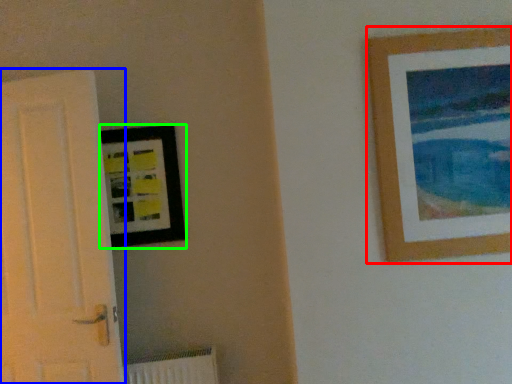
Question: Considering the real-world distances, which object is farthest from picture frame (highlighted by a red box)? door (highlighted by a blue box) or picture frame (highlighted by a green box)?

Choices:
 (A) door
 (B) picture frame

Answer: (A)